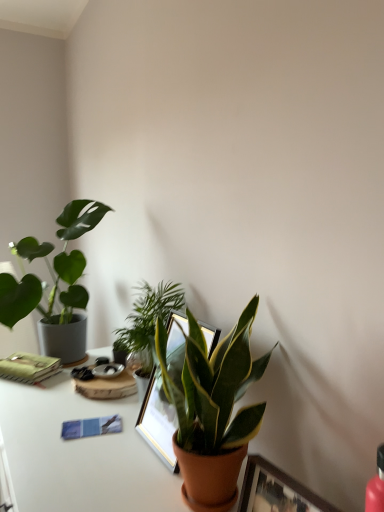
At what (x,y) coordinates should I click in order to perform the action: click on vacant space in front of blue paper journal at lower left. Please return your answer as a coordinate pair (x, y). Looking at the image, I should click on (72, 478).